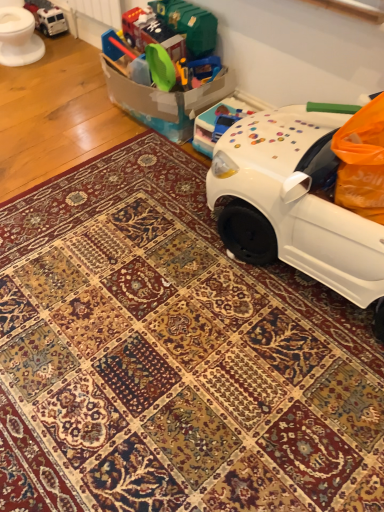
Locate an element on the screen. This screenshot has height=512, width=384. free space in front of white glossy toilet bowl at upper left is located at coordinates (27, 77).